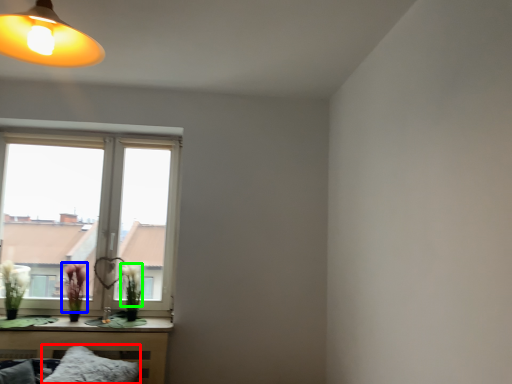
Question: Which object is the closest to the pillow (highlighted by a red box)? Choose among these: flower (highlighted by a blue box) or flower (highlighted by a green box).

Choices:
 (A) flower
 (B) flower

Answer: (A)